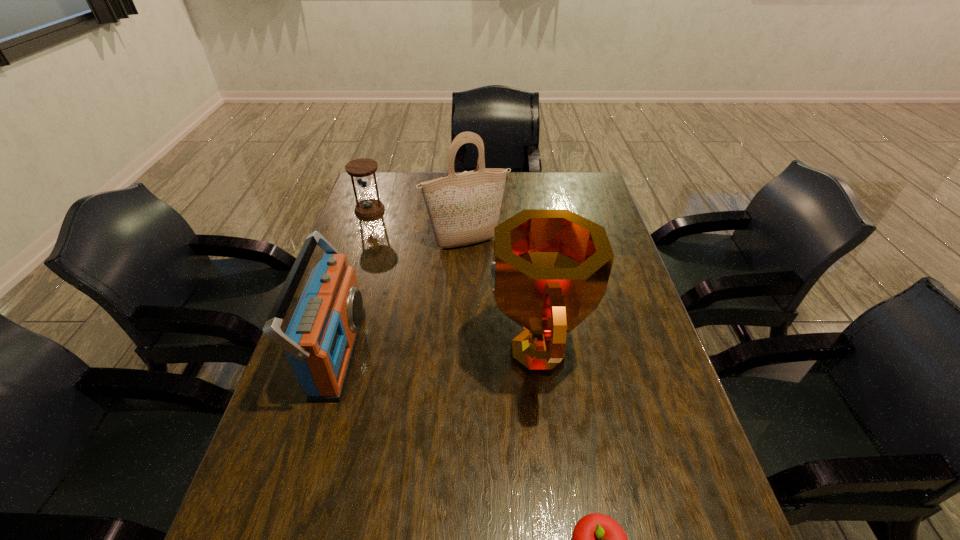
Find the location of `free point located 0.050m on the front of the farthest object`. free point located 0.050m on the front of the farthest object is located at coordinates (364, 227).

The image size is (960, 540). I want to click on object located at the far edge, so click(x=368, y=207).

Find the location of a particular element. Image resolution: width=960 pixels, height=540 pixels. radio receiver present at the left edge is located at coordinates (320, 340).

Find the location of `hourglass located at the left edge`. hourglass located at the left edge is located at coordinates (368, 207).

Find the location of a particular element. The width and height of the screenshot is (960, 540). object located at the far left corner is located at coordinates (368, 207).

Identify the location of free space at the far edge of the desktop. The height and width of the screenshot is (540, 960). (408, 191).

Locate an element on the screen. This screenshot has height=540, width=960. free point at the left edge is located at coordinates (389, 232).

Where is `vacant point at the right edge`? vacant point at the right edge is located at coordinates (587, 208).

Image resolution: width=960 pixels, height=540 pixels. In the image, there is a desktop. In order to click on vacant space at the far right corner in this screenshot , I will do `click(574, 182)`.

Locate an element on the screen. The width and height of the screenshot is (960, 540). blank region between the radio receiver and the award is located at coordinates (437, 352).